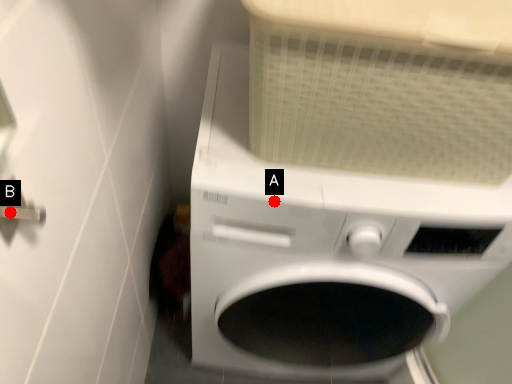
Question: Two points are circled on the image, labeled by A and B beside each circle. Which point appears farthest from the camera in this image?

Choices:
 (A) A is further
 (B) B is further

Answer: (A)